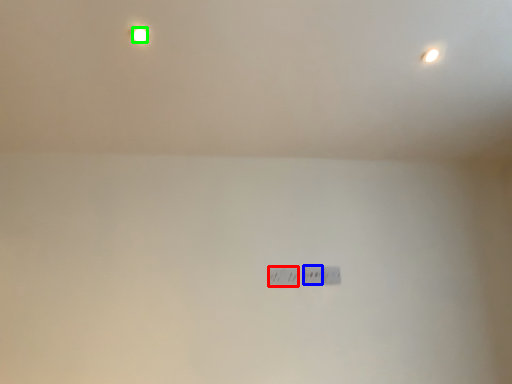
Question: Which object is the farthest from power plugs and sockets (highlighted by a red box)? Choose among these: power plugs and sockets (highlighted by a blue box) or light bulb (highlighted by a green box).

Choices:
 (A) power plugs and sockets
 (B) light bulb

Answer: (B)